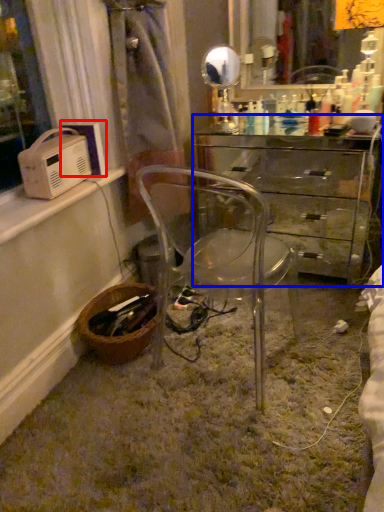
Question: Among these objects, which one is nearest to the camera, appliance (highlighted by a red box) or desk (highlighted by a blue box)?

Choices:
 (A) appliance
 (B) desk

Answer: (A)